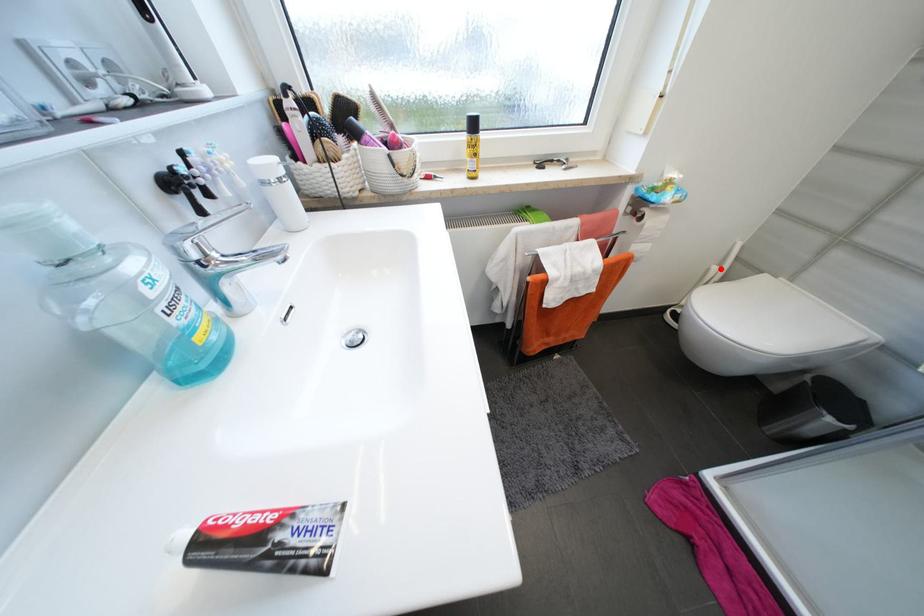
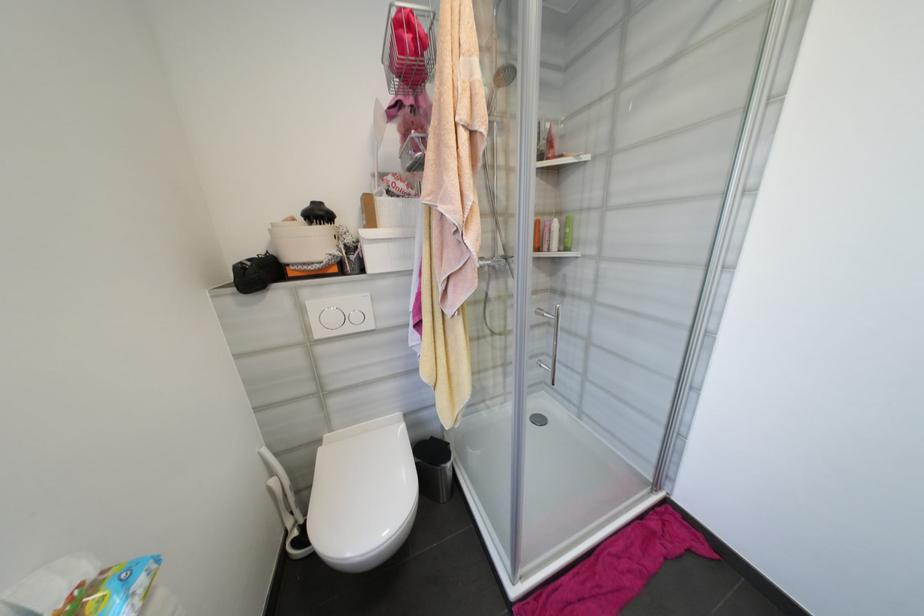
The point at the highlighted location is marked in the first image. Where is the corresponding point in the second image?

(277, 482)